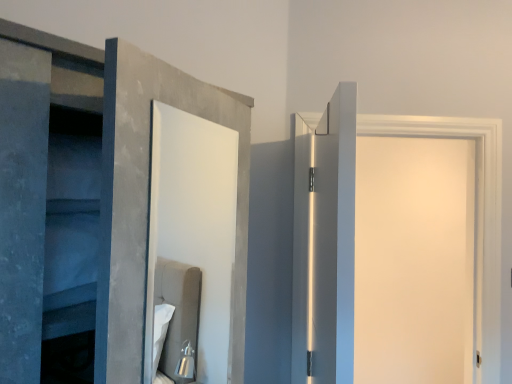
Question: Considering the positions of white matte door at right, which is the second door from front to back, and white glossy door at upper right, positioned as the first door in left-to-right order, in the image, is white matte door at right, which is the second door from front to back, bigger or smaller than white glossy door at upper right, positioned as the first door in left-to-right order,?

Choices:
 (A) small
 (B) big

Answer: (B)

Question: Relative to white glossy door at upper right, which is counted as the 2th door, starting from the back, is white matte door at right, which is the second door from front to back, in front or behind?

Choices:
 (A) front
 (B) behind

Answer: (B)

Question: From the image's perspective, is white matte door at right, arranged as the 1th door when viewed from the right, located above or below white glossy door at upper right, positioned as the first door in left-to-right order?

Choices:
 (A) above
 (B) below

Answer: (B)

Question: Is white glossy door at upper right, positioned as the first door in left-to-right order, bigger or smaller than white matte door at right, which ranks as the first door in back-to-front order?

Choices:
 (A) big
 (B) small

Answer: (B)

Question: Considering the positions of white glossy door at upper right, placed as the first door when sorted from front to back, and white matte door at right, arranged as the 1th door when viewed from the right, in the image, is white glossy door at upper right, placed as the first door when sorted from front to back, taller or shorter than white matte door at right, arranged as the 1th door when viewed from the right,?

Choices:
 (A) tall
 (B) short

Answer: (B)

Question: Relative to white matte door at right, which is the second door from front to back, is white glossy door at upper right, which ranks as the 2th door in right-to-left order, in front or behind?

Choices:
 (A) behind
 (B) front

Answer: (B)

Question: From the image's perspective, relative to white matte door at right, the 2th door from the left, is white glossy door at upper right, which is counted as the 2th door, starting from the back, above or below?

Choices:
 (A) above
 (B) below

Answer: (A)